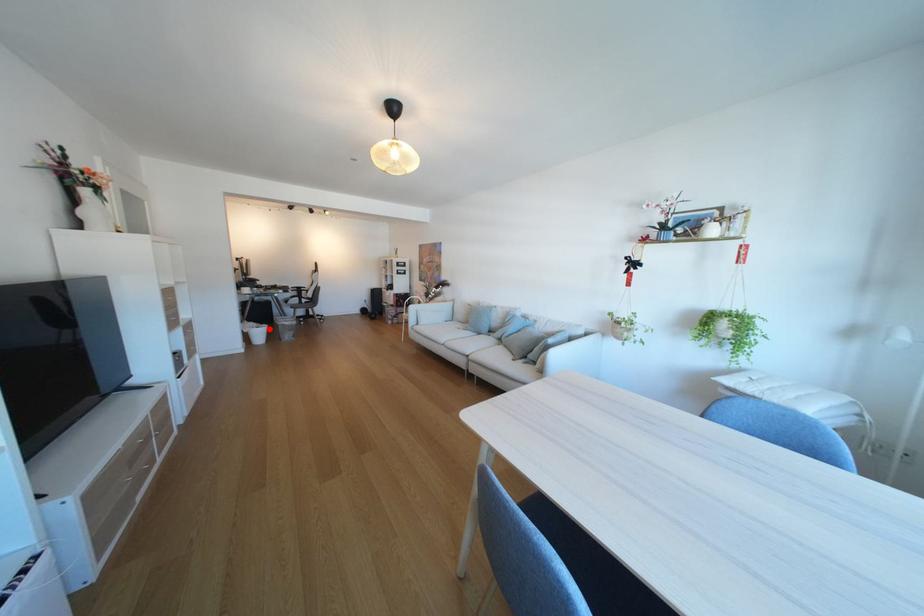
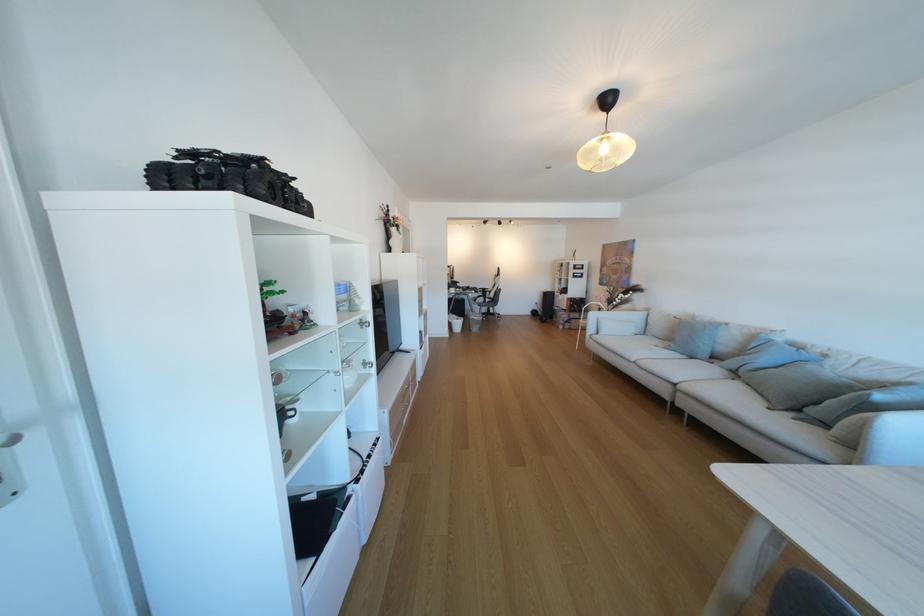
Locate, in the second image, the point that corresponds to the highlighted location in the first image.

(468, 321)